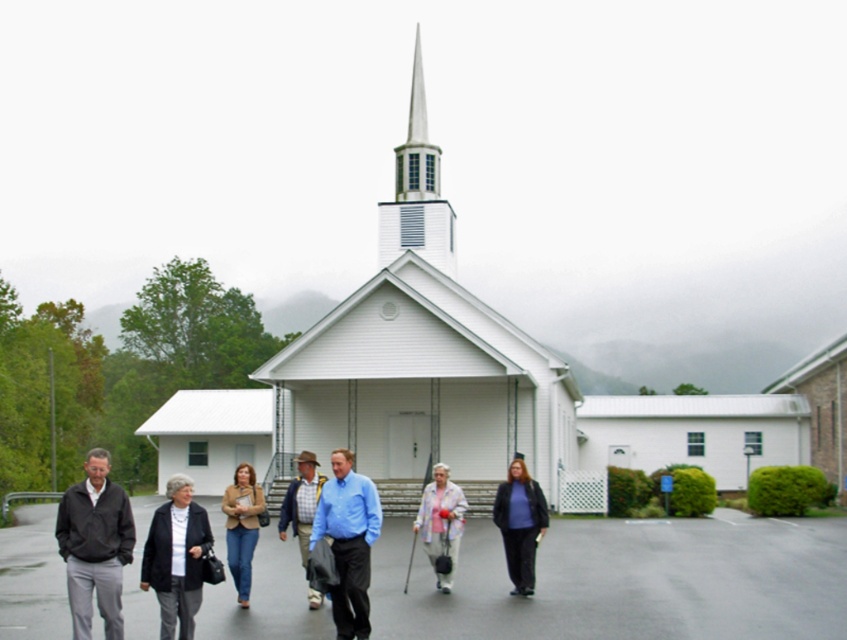
You are standing in front of the church and want to take a photo of the smooth asphalt pavement at center and the matte black jacket at center. Which object should you focus on first if you want to capture both in a single shot without moving the camera?

The smooth asphalt pavement at center is much taller than the matte black jacket at center, so you should focus on the smooth asphalt pavement at center first to ensure it fits within the frame.

You are standing in front of the white wooden church at center and want to take a photo of it. If your camera can focus on objects up to 30 meters away, will it be able to capture the church clearly?

The distance between the white wooden church at center and the camera is 27.25 meters, which is within the camera focus range of 30 meters. Therefore, the camera can capture the church clearly.